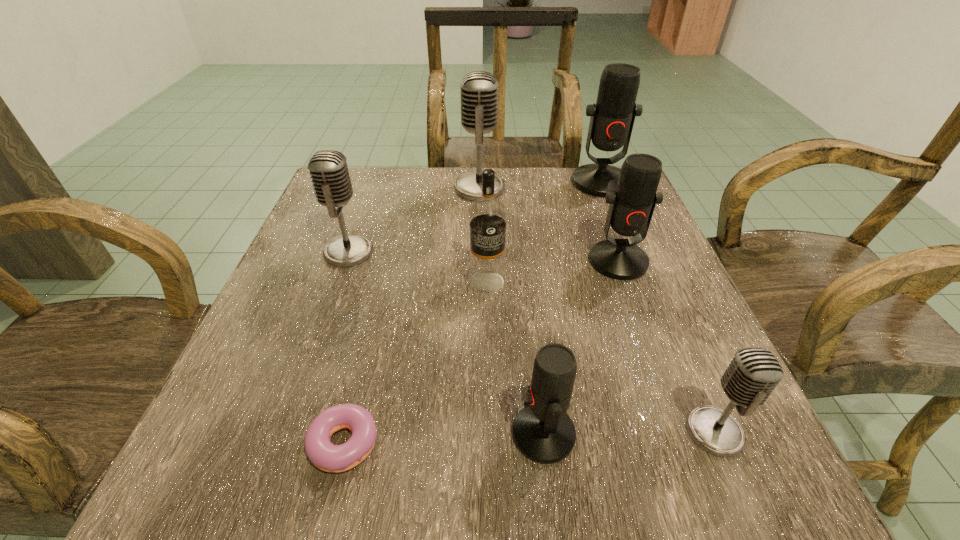
Where is `free space between the leftmost gray microphone and the second gray microphone from right to left`? The width and height of the screenshot is (960, 540). free space between the leftmost gray microphone and the second gray microphone from right to left is located at coordinates (414, 220).

In order to click on vacant area between the second biggest red microphone and the biggest gray microphone in this screenshot , I will do `click(549, 225)`.

You are a GUI agent. You are given a task and a screenshot of the screen. Output one action in this format:
    pyautogui.click(x=<x>, y=<y>)
    Task: Click on the empty location between the biggest gray microphone and the farthest red microphone
    The image size is (960, 540).
    Given the screenshot: What is the action you would take?
    pyautogui.click(x=540, y=185)

Identify the location of free spot between the smallest gray microphone and the nearest red microphone. (629, 433).

The image size is (960, 540). Identify the location of unoccupied area between the nearest red microphone and the farthest red microphone. (572, 308).

Identify which object is the third closest to the leftmost gray microphone. Please provide its 2D coordinates. Your answer should be formatted as a tuple, i.e. [(x, y)], where the tuple contains the x and y coordinates of a point satisfying the conditions above.

[(323, 454)]

Locate an element on the screen. This screenshot has height=540, width=960. object that is the fifth closest to the purple doughnut is located at coordinates (631, 207).

Locate an element on the screen. This screenshot has height=540, width=960. microphone that stands as the fifth closest to the vodka is located at coordinates (612, 118).

Image resolution: width=960 pixels, height=540 pixels. What are the coordinates of `the second closest microphone to the leftmost red microphone` in the screenshot? It's located at (631, 207).

Select which gray microphone appears as the second closest to the vodka. Please provide its 2D coordinates. Your answer should be formatted as a tuple, i.e. [(x, y)], where the tuple contains the x and y coordinates of a point satisfying the conditions above.

[(478, 89)]